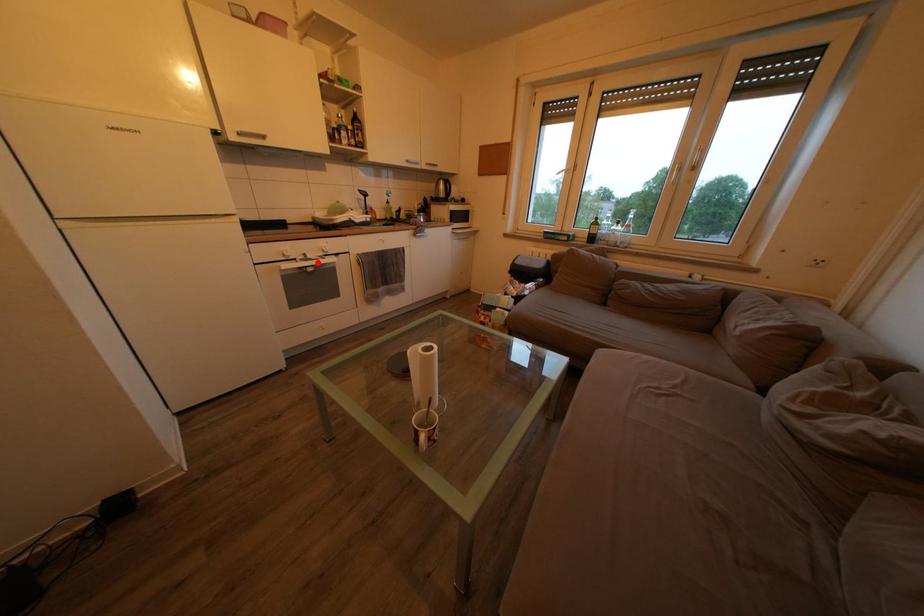
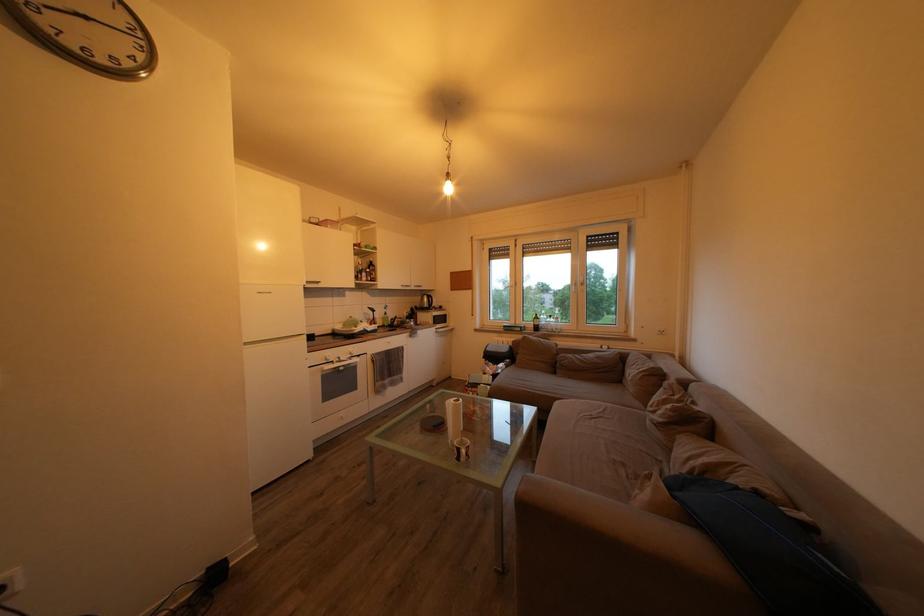
Question: I am providing you with two images of the same scene from different viewpoints. Given a red point in image1, look at the same physical point in image2. Is it:

Choices:
 (A) Closer to the viewpoint
 (B) Farther from the viewpoint

Answer: (B)